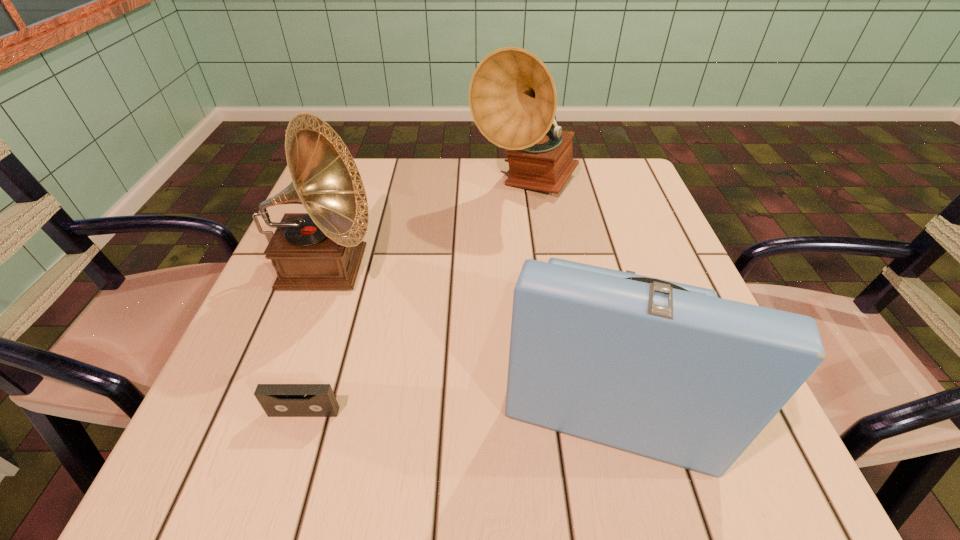
This screenshot has width=960, height=540. Identify the location of free point between the leftmost phonograph record and the farthest phonograph record. (425, 227).

You are a GUI agent. You are given a task and a screenshot of the screen. Output one action in this format:
    pyautogui.click(x=<x>, y=<y>)
    Task: Click on the vacant region between the leftmost phonograph record and the farthest object
    
    Given the screenshot: What is the action you would take?
    pyautogui.click(x=425, y=227)

This screenshot has height=540, width=960. What are the coordinates of `free space between the shortest object and the leftmost phonograph record` in the screenshot? It's located at (315, 340).

I want to click on the third closest object to the leftmost phonograph record, so click(x=668, y=371).

Locate which object is the closest to the leftmost phonograph record. Please provide its 2D coordinates. Your answer should be formatted as a tuple, i.e. [(x, y)], where the tuple contains the x and y coordinates of a point satisfying the conditions above.

[(277, 400)]

This screenshot has width=960, height=540. In order to click on phonograph record that can be found as the closest to the farthest object in this screenshot , I will do `click(323, 249)`.

This screenshot has width=960, height=540. Identify the location of phonograph record that is the second closest to the shortest object. (668, 371).